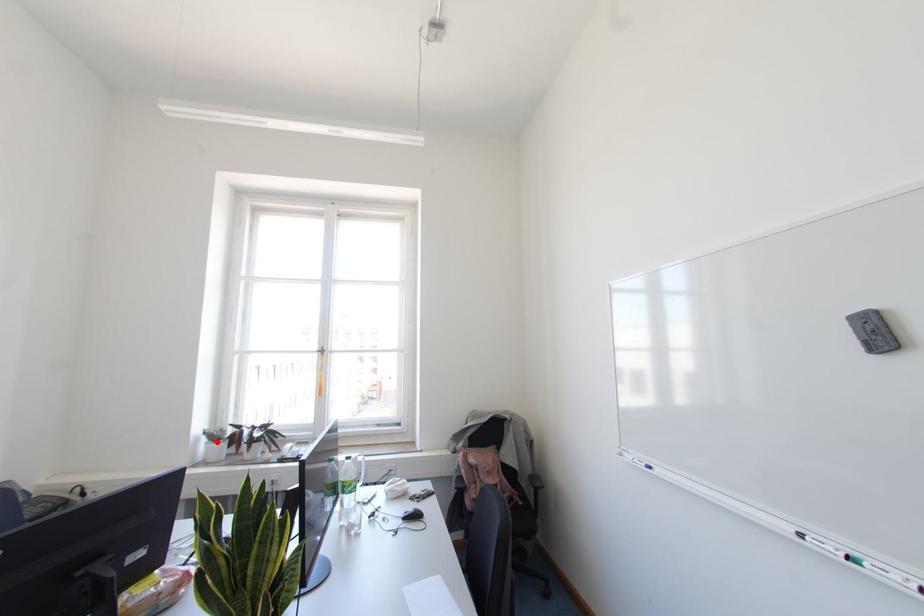
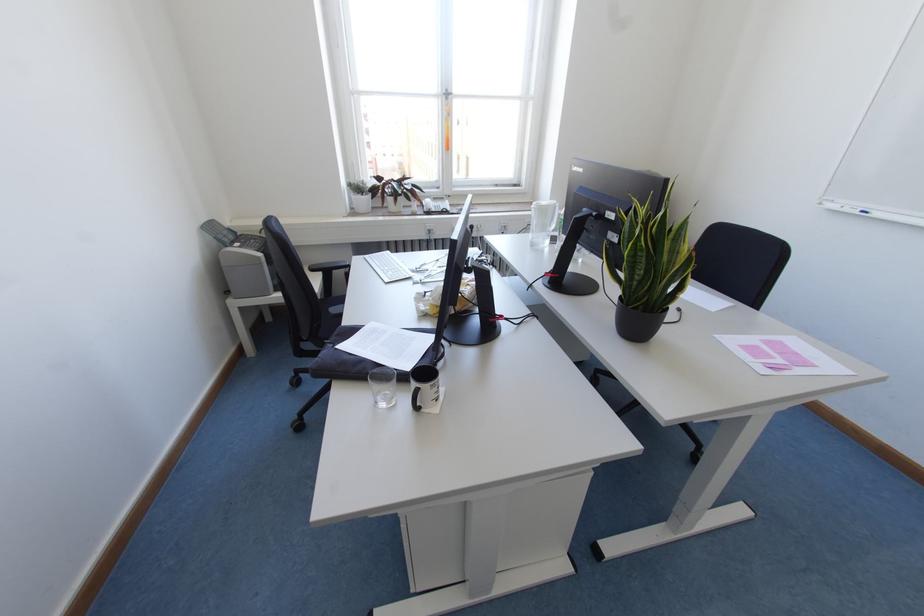
In the second image, find the point that corresponds to the highlighted location in the first image.

(361, 195)